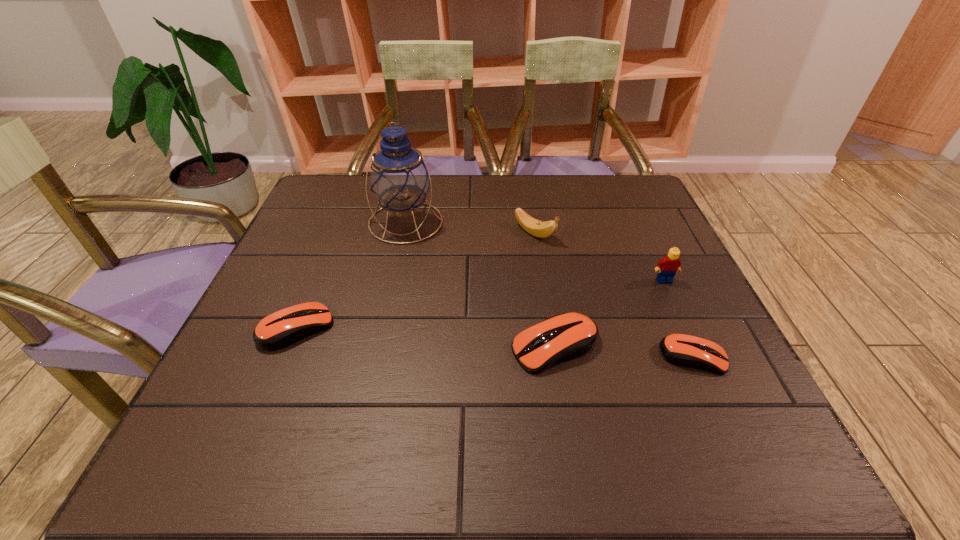
This screenshot has width=960, height=540. I want to click on blank area in the image that satisfies the following two spatial constraints: 1. on the front side of the second computer mouse from right to left; 2. on the right side of the shortest object, so click(x=557, y=357).

I want to click on blank area in the image that satisfies the following two spatial constraints: 1. on the front side of the shortest computer mouse; 2. on the left side of the leftmost computer mouse, so click(x=285, y=357).